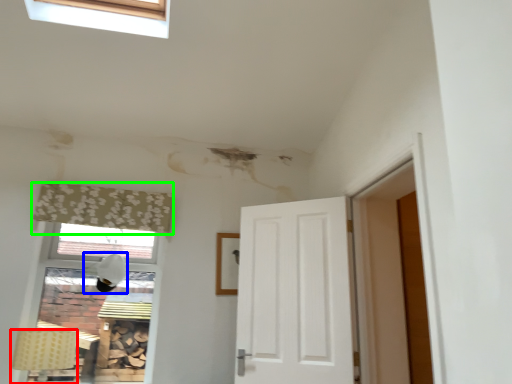
Question: Estimate the real-world distances between objects in this image. Which object is closer to lamp (highlighted by a red box), lamp (highlighted by a blue box) or curtain (highlighted by a green box)?

Choices:
 (A) lamp
 (B) curtain

Answer: (A)